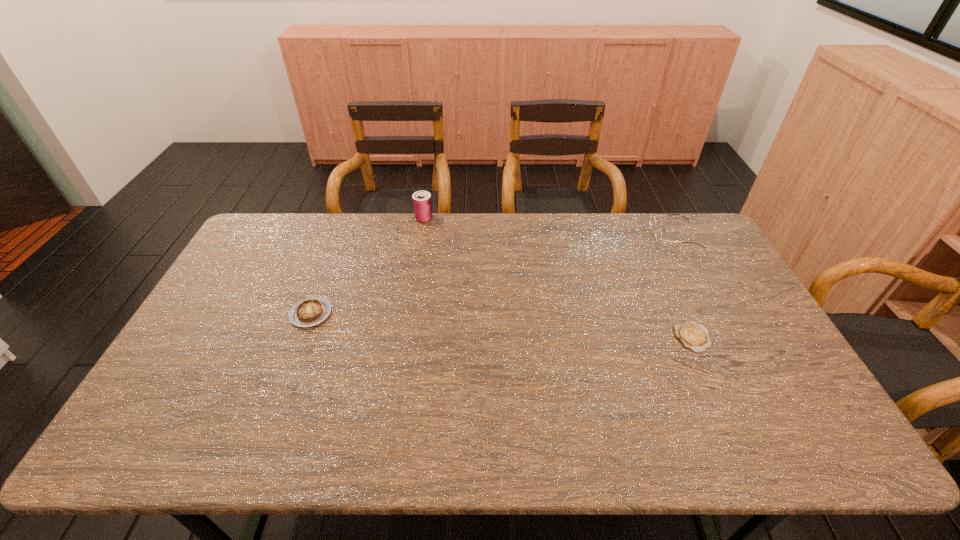
Find the location of a particular element. vacant space located 0.070m through the lenses of the third shortest object is located at coordinates coord(634,234).

What are the coordinates of `free location located 0.320m on the front of the third tallest object` in the screenshot? It's located at (266, 434).

Locate an element on the screen. vacant region located 0.300m on the back of the right quiche is located at coordinates (656, 256).

Where is `can located at the far edge`? The width and height of the screenshot is (960, 540). can located at the far edge is located at coordinates (422, 204).

Identify the location of spectacles located in the far edge section of the desktop. (658, 234).

I want to click on object that is positioned at the right edge, so click(658, 234).

Identify the location of object located at the far right corner. (658, 234).

You are a GUI agent. You are given a task and a screenshot of the screen. Output one action in this format:
    pyautogui.click(x=<x>, y=<y>)
    Task: Click on the free point at the far edge
    The width and height of the screenshot is (960, 540).
    Given the screenshot: What is the action you would take?
    pyautogui.click(x=657, y=225)

Locate an element on the screen. free space at the left edge of the desktop is located at coordinates (249, 277).

In the image, there is a desktop. What are the coordinates of `vacant space at the right edge` in the screenshot? It's located at (695, 297).